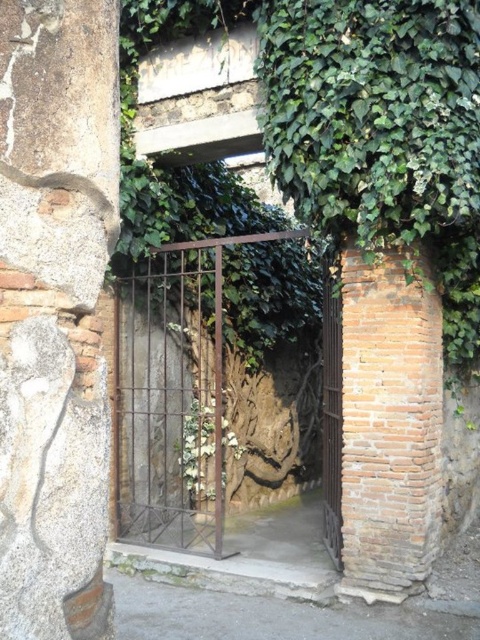
You are a delivery person trying to enter through the entranceway. The path to the entrance is narrow, and your delivery cart is 1.2 meters wide. Can you pass through the entrance if you go through the brown wrought iron gate at center and the rusty metal gate at center?

The brown wrought iron gate at center is larger in size than rusty metal gate at center. Since the cart is 1.2 meters wide, it depends on the width of the larger gate. However, without specific measurements, we cannot confirm if it will fit. Please check the actual gate dimensions before proceeding.